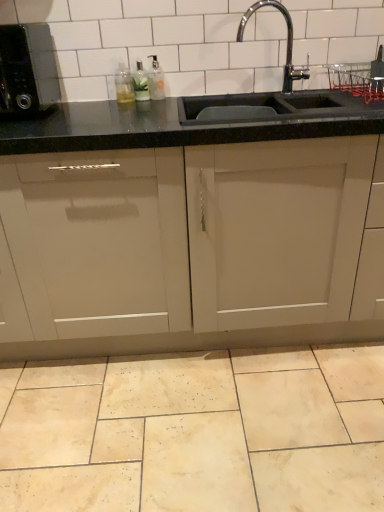
Question: Is matte beige cabinet at center oriented towards translucent glass bottle at upper left, arranged as the second bottle when viewed from the left?

Choices:
 (A) yes
 (B) no

Answer: (B)

Question: Can you confirm if matte beige cabinet at center is positioned to the right of translucent glass bottle at upper left, the second bottle when ordered from right to left?

Choices:
 (A) no
 (B) yes

Answer: (B)

Question: Is matte beige cabinet at center not inside translucent glass bottle at upper left, the second bottle when ordered from right to left?

Choices:
 (A) yes
 (B) no

Answer: (A)

Question: From a real-world perspective, is matte beige cabinet at center located beneath translucent glass bottle at upper left, the second bottle when ordered from right to left?

Choices:
 (A) no
 (B) yes

Answer: (B)

Question: Does matte beige cabinet at center have a greater width compared to translucent glass bottle at upper left, the second bottle when ordered from right to left?

Choices:
 (A) yes
 (B) no

Answer: (A)

Question: Is matte beige cabinet at center oriented away from translucent glass bottle at upper left, the second bottle when ordered from right to left?

Choices:
 (A) no
 (B) yes

Answer: (A)

Question: Is beige marble tile at lower center positioned far away from clear glass bottle at upper center, which is the first bottle from right to left?

Choices:
 (A) no
 (B) yes

Answer: (B)

Question: Is beige marble tile at lower center turned away from clear glass bottle at upper center, which is the first bottle from right to left?

Choices:
 (A) no
 (B) yes

Answer: (A)

Question: From the image's perspective, is beige marble tile at lower center under clear glass bottle at upper center, the third bottle in the left-to-right sequence?

Choices:
 (A) no
 (B) yes

Answer: (B)

Question: From a real-world perspective, is beige marble tile at lower center beneath clear glass bottle at upper center, the third bottle in the left-to-right sequence?

Choices:
 (A) no
 (B) yes

Answer: (B)

Question: Does beige marble tile at lower center have a larger size compared to clear glass bottle at upper center, which is the first bottle from right to left?

Choices:
 (A) yes
 (B) no

Answer: (A)

Question: Is beige marble tile at lower center positioned beyond the bounds of clear glass bottle at upper center, the third bottle in the left-to-right sequence?

Choices:
 (A) yes
 (B) no

Answer: (A)

Question: Is black granite sink at upper center positioned far away from translucent plastic bottle at upper left, the 3th bottle positioned from the right?

Choices:
 (A) yes
 (B) no

Answer: (B)